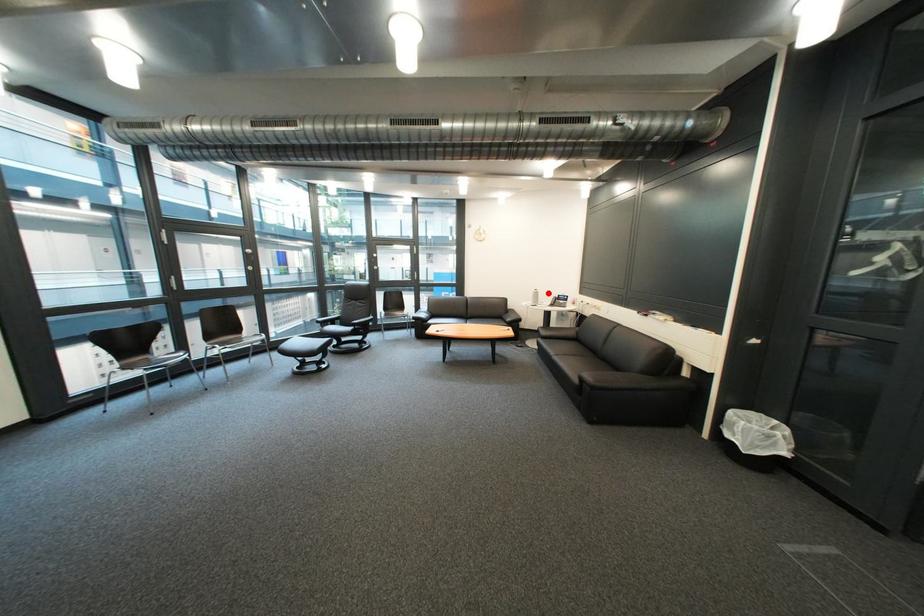
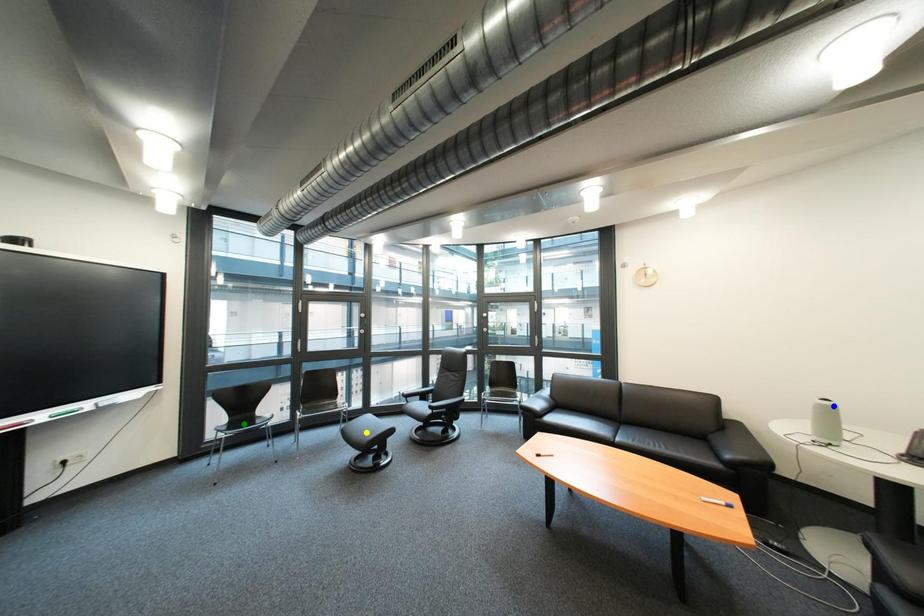
Question: I am providing you with two images of the same scene from different viewpoints. A red point is marked on the first image. You are given multiple points on the second image. Which point in image 2 represents the same 3d spot as the red point in image 1?

Choices:
 (A) green point
 (B) blue point
 (C) yellow point

Answer: (B)